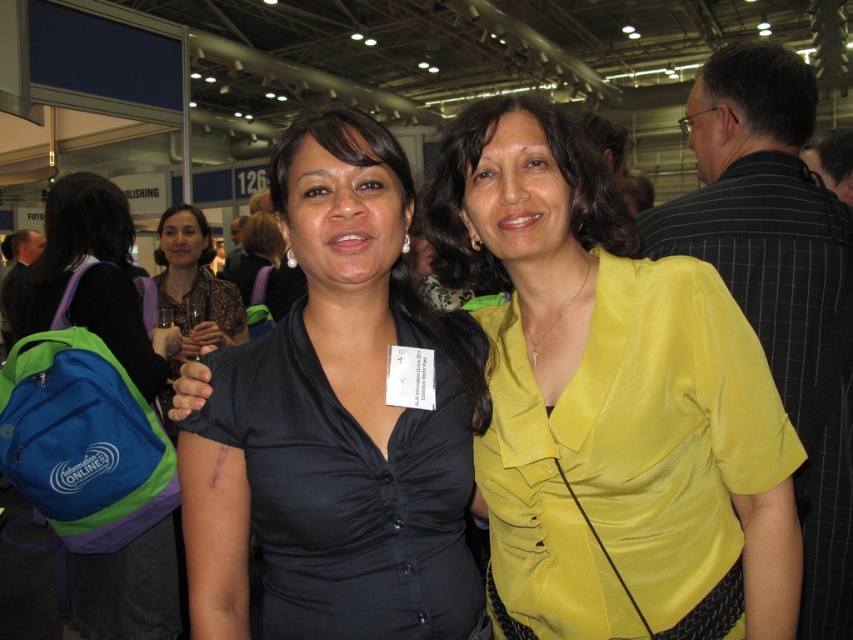
Question: Is black satin blouse at center smaller than matte black blouse at center?

Choices:
 (A) no
 (B) yes

Answer: (B)

Question: Which point is closer to the camera taking this photo?

Choices:
 (A) (236, 438)
 (B) (190, 282)

Answer: (A)

Question: Among these objects, which one is farthest from the camera?

Choices:
 (A) blue fabric backpack at left
 (B) matte black blouse at center

Answer: (B)

Question: Does yellow satin blouse at center come in front of blue fabric backpack at left?

Choices:
 (A) yes
 (B) no

Answer: (A)

Question: Based on their relative distances, which object is farther from the yellow satin blouse at center?

Choices:
 (A) blue fabric backpack at left
 (B) black satin blouse at center
 (C) matte black blouse at center

Answer: (C)

Question: Is blue fabric backpack at left below matte black blouse at center?

Choices:
 (A) no
 (B) yes

Answer: (B)